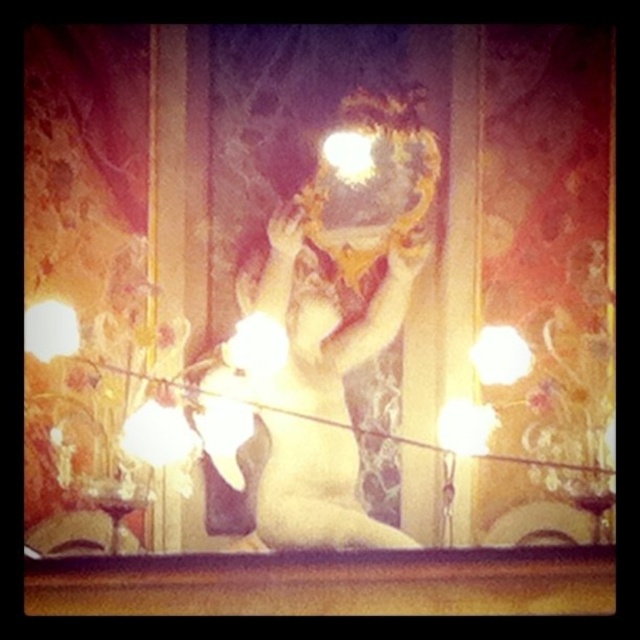
Question: Where is smooth gold statue at center located in relation to white satin dress at center in the image?

Choices:
 (A) left
 (B) right

Answer: (B)

Question: Among these objects, which one is farthest from the camera?

Choices:
 (A) white satin dress at center
 (B) smooth gold statue at center

Answer: (A)

Question: Is smooth gold statue at center positioned before white satin dress at center?

Choices:
 (A) yes
 (B) no

Answer: (A)

Question: Among these objects, which one is nearest to the camera?

Choices:
 (A) smooth gold statue at center
 (B) white satin dress at center

Answer: (A)

Question: Can you confirm if smooth gold statue at center is wider than white satin dress at center?

Choices:
 (A) yes
 (B) no

Answer: (A)

Question: Among these objects, which one is farthest from the camera?

Choices:
 (A) white satin dress at center
 (B) smooth gold statue at center

Answer: (A)